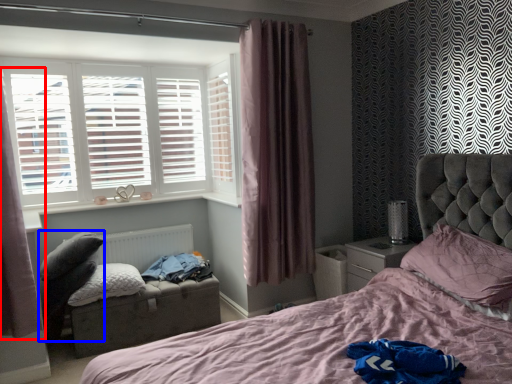
Question: Which object is closer to the camera taking this photo, curtain (highlighted by a red box) or swivel chair (highlighted by a blue box)?

Choices:
 (A) curtain
 (B) swivel chair

Answer: (A)